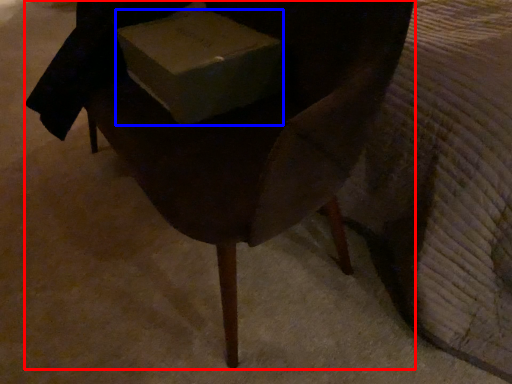
Question: Which object is further to the camera taking this photo, chair (highlighted by a red box) or box (highlighted by a blue box)?

Choices:
 (A) chair
 (B) box

Answer: (B)